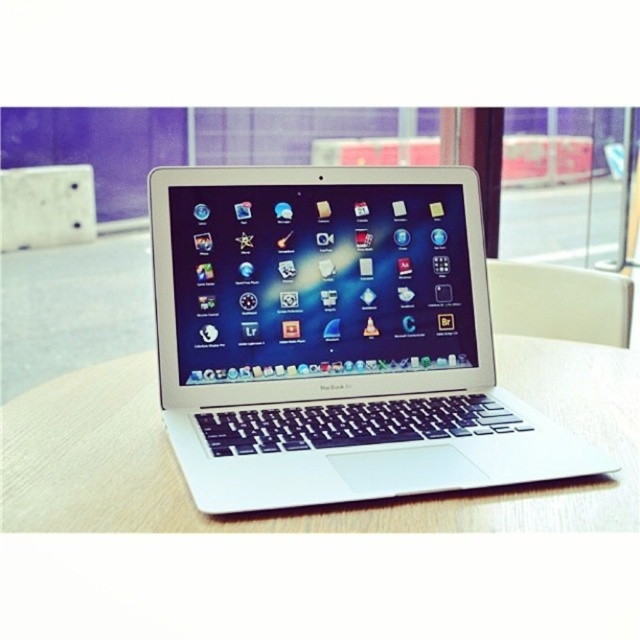
Can you confirm if silver metallic laptop at center is positioned to the right of white plastic chair at right?

In fact, silver metallic laptop at center is to the left of white plastic chair at right.

I want to click on silver metallic laptop at center, so (x=333, y=339).

Is wooden table at center shorter than white plastic chair at right?

Correct, wooden table at center is not as tall as white plastic chair at right.

Which is below, wooden table at center or white plastic chair at right?

wooden table at center

Image resolution: width=640 pixels, height=640 pixels. In order to click on wooden table at center in this screenshot , I will do `click(305, 508)`.

Does silver metallic laptop at center have a lesser height compared to wooden table at center?

In fact, silver metallic laptop at center may be taller than wooden table at center.

Where is `silver metallic laptop at center`? Image resolution: width=640 pixels, height=640 pixels. silver metallic laptop at center is located at coordinates (333, 339).